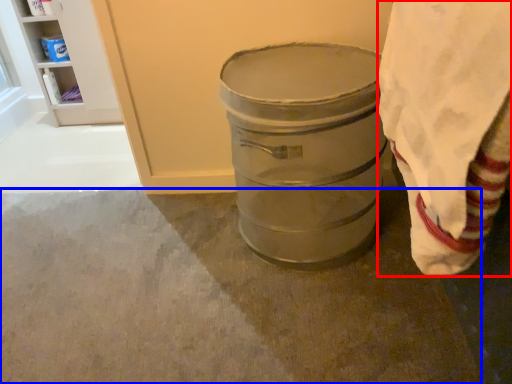
Question: Which object appears farthest to the camera in this image, cloth (highlighted by a red box) or concrete (highlighted by a blue box)?

Choices:
 (A) cloth
 (B) concrete

Answer: (B)